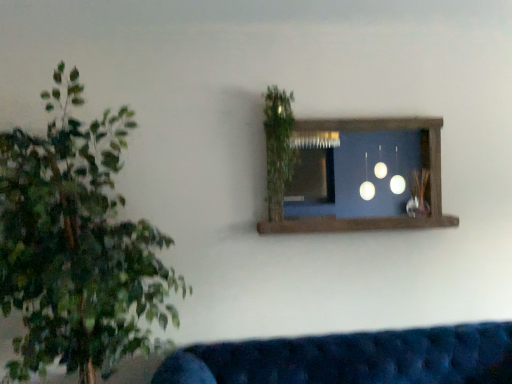
Question: Is velvet blue couch at lower center taller or shorter than green leafy plant at upper center?

Choices:
 (A) tall
 (B) short

Answer: (B)

Question: Relative to green leafy plant at upper center, is velvet blue couch at lower center in front or behind?

Choices:
 (A) behind
 (B) front

Answer: (B)

Question: Which of these objects is positioned farthest from the green leafy plant at upper center?

Choices:
 (A) brown wooden window frame at upper center
 (B) velvet blue couch at lower center
 (C) green leafy plant at left

Answer: (B)

Question: Estimate the real-world distances between objects in this image. Which object is farther from the green leafy plant at upper center?

Choices:
 (A) green leafy plant at left
 (B) velvet blue couch at lower center
 (C) brown wooden window frame at upper center

Answer: (B)